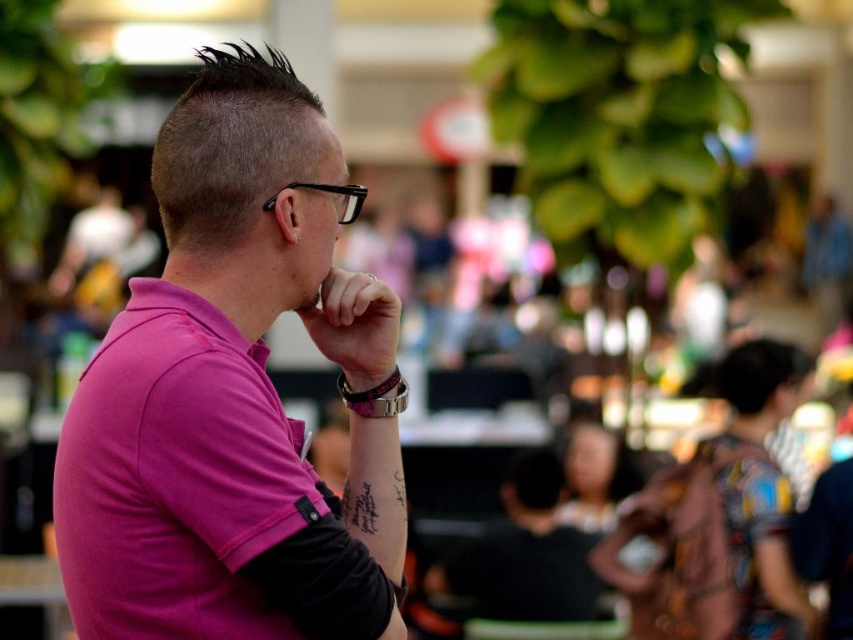
Question: Is pink matte shirt at center smaller than matte black wristwatch at center?

Choices:
 (A) no
 (B) yes

Answer: (A)

Question: Which point is farther from the camera taking this photo?

Choices:
 (A) (354, 193)
 (B) (358, 288)
 (C) (299, 525)

Answer: (B)

Question: Can you confirm if matte black wristwatch at center is positioned to the left of black plastic glasses at upper left?

Choices:
 (A) yes
 (B) no

Answer: (B)

Question: Among these points, which one is farthest from the camera?

Choices:
 (A) coord(341,186)
 (B) coord(303,468)
 (C) coord(370,300)

Answer: (C)

Question: Which object appears farthest from the camera in this image?

Choices:
 (A) black plastic glasses at upper left
 (B) pink matte shirt at center

Answer: (A)

Question: Does pink matte shirt at center have a smaller size compared to matte black wristwatch at center?

Choices:
 (A) no
 (B) yes

Answer: (A)